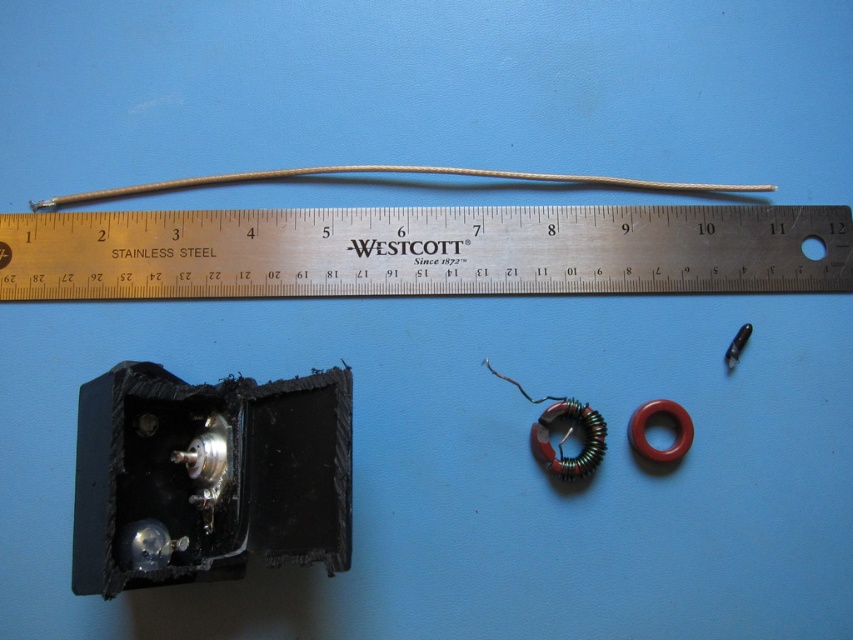
Question: Among these points, which one is nearest to the camera?

Choices:
 (A) (105, 198)
 (B) (103, 278)

Answer: (B)

Question: Is stainless steel ruler at upper center to the right of gray matte wire at center from the viewer's perspective?

Choices:
 (A) yes
 (B) no

Answer: (A)

Question: Can you confirm if stainless steel ruler at upper center is smaller than gray matte wire at center?

Choices:
 (A) yes
 (B) no

Answer: (B)

Question: Which object appears closest to the camera in this image?

Choices:
 (A) gray matte wire at center
 (B) stainless steel ruler at upper center

Answer: (B)

Question: Is stainless steel ruler at upper center positioned at the back of gray matte wire at center?

Choices:
 (A) no
 (B) yes

Answer: (A)